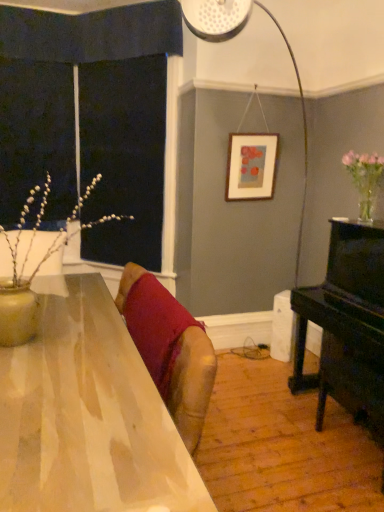
Image resolution: width=384 pixels, height=512 pixels. I want to click on matte wooden picture frame at upper center, so click(x=251, y=166).

Describe the element at coordinates (88, 415) in the screenshot. I see `shiny wooden table at center` at that location.

Describe the element at coordinates (187, 376) in the screenshot. I see `velvet red cushion at center` at that location.

Where is `black polished piano at right`? black polished piano at right is located at coordinates (346, 324).

Locate an element on the screen. The image size is (384, 512). matte wooden picture frame at upper center is located at coordinates (251, 166).

Is point (270, 192) positioned in front of point (167, 362)?

No, it is not.

From the image's perspective, would you say matte wooden picture frame at upper center is shown under velvet red cushion at center?

Incorrect, from the image's perspective, matte wooden picture frame at upper center is higher than velvet red cushion at center.

How distant is matte wooden picture frame at upper center from velvet red cushion at center?

matte wooden picture frame at upper center is 1.56 meters away from velvet red cushion at center.

How many degrees apart are the facing directions of matte wooden picture frame at upper center and velvet red cushion at center?

91.9 degrees.

Based on the photo, is translucent glass vase at right facing away from black polished piano at right?

translucent glass vase at right does not have its back to black polished piano at right.

Which object is positioned more to the right, translucent glass vase at right or black polished piano at right?

black polished piano at right is more to the right.

What's the angular difference between translucent glass vase at right and black polished piano at right's facing directions?

The angular difference between translucent glass vase at right and black polished piano at right is 0.651 degrees.

From a real-world perspective, is translucent glass vase at right above or below black polished piano at right?

Clearly, from a real-world perspective, translucent glass vase at right is above black polished piano at right.

From the image's perspective, which one is positioned lower, matte wooden picture frame at upper center or shiny wooden table at center?

shiny wooden table at center, from the image's perspective.

Considering the relative sizes of matte wooden picture frame at upper center and shiny wooden table at center in the image provided, is matte wooden picture frame at upper center shorter than shiny wooden table at center?

Correct, matte wooden picture frame at upper center is not as tall as shiny wooden table at center.

Is matte wooden picture frame at upper center located outside shiny wooden table at center?

Absolutely, matte wooden picture frame at upper center is external to shiny wooden table at center.

Which object is positioned more to the left, matte wooden picture frame at upper center or shiny wooden table at center?

Positioned to the left is shiny wooden table at center.

Considering the sizes of objects black polished piano at right and shiny wooden table at center in the image provided, who is bigger, black polished piano at right or shiny wooden table at center?

Bigger between the two is shiny wooden table at center.

Considering the positions of objects black polished piano at right and shiny wooden table at center in the image provided, who is behind, black polished piano at right or shiny wooden table at center?

Positioned behind is black polished piano at right.

Considering the relative sizes of black polished piano at right and shiny wooden table at center in the image provided, is black polished piano at right thinner than shiny wooden table at center?

Correct, the width of black polished piano at right is less than that of shiny wooden table at center.

Considering the sizes of objects velvet red cushion at center and shiny wooden table at center in the image provided, who is smaller, velvet red cushion at center or shiny wooden table at center?

velvet red cushion at center.

Which is closer, (203, 373) or (73, 292)?

The point (203, 373) is closer.

Is shiny wooden table at center surrounded by velvet red cushion at center?

Actually, shiny wooden table at center is outside velvet red cushion at center.

Looking at their sizes, would you say shiny wooden table at center is wider or thinner than matte wooden picture frame at upper center?

Clearly, shiny wooden table at center has more width compared to matte wooden picture frame at upper center.

Is shiny wooden table at center next to matte wooden picture frame at upper center and touching it?

shiny wooden table at center and matte wooden picture frame at upper center are not in contact.

Is shiny wooden table at center outside of matte wooden picture frame at upper center?

Absolutely, shiny wooden table at center is external to matte wooden picture frame at upper center.

Where is `table below the matte wooden picture frame at upper center (from the image's perspective)`? This screenshot has width=384, height=512. table below the matte wooden picture frame at upper center (from the image's perspective) is located at coordinates (88, 415).

This screenshot has width=384, height=512. I want to click on floral arrangement above the black polished piano at right (from a real-world perspective), so click(365, 179).

Visually, is black polished piano at right positioned to the left or to the right of translucent glass vase at right?

black polished piano at right is to the right of translucent glass vase at right.

Is black polished piano at right facing away from translucent glass vase at right?

No, black polished piano at right is not facing the opposite direction of translucent glass vase at right.

Where is `swivel chair on the left of matte wooden picture frame at upper center`? The width and height of the screenshot is (384, 512). swivel chair on the left of matte wooden picture frame at upper center is located at coordinates tap(187, 376).

Find the location of a particular element. floral arrangement located above the black polished piano at right (from a real-world perspective) is located at coordinates (365, 179).

Estimate the real-world distances between objects in this image. Which object is further from black polished piano at right, translucent glass vase at right or matte wooden picture frame at upper center?

matte wooden picture frame at upper center.

Looking at the image, which one is located further to black polished piano at right, velvet red cushion at center or translucent glass vase at right?

Based on the image, velvet red cushion at center appears to be further to black polished piano at right.

Based on their spatial positions, is matte wooden picture frame at upper center or black polished piano at right further from velvet red cushion at center?

Among the two, matte wooden picture frame at upper center is located further to velvet red cushion at center.

When comparing their distances from translucent glass vase at right, does velvet red cushion at center or black polished piano at right seem further?

Among the two, velvet red cushion at center is located further to translucent glass vase at right.

Which object lies further to the anchor point shiny wooden table at center, translucent glass vase at right or velvet red cushion at center?

translucent glass vase at right is positioned further to the anchor shiny wooden table at center.

Looking at this image, which object lies nearer to the anchor point matte wooden picture frame at upper center, velvet red cushion at center or translucent glass vase at right?

The object closer to matte wooden picture frame at upper center is translucent glass vase at right.

From the image, which object appears to be nearer to shiny wooden table at center, black polished piano at right or velvet red cushion at center?

velvet red cushion at center is closer to shiny wooden table at center.

Based on the photo, when comparing their distances from black polished piano at right, does velvet red cushion at center or shiny wooden table at center seem closer?

velvet red cushion at center is positioned closer to the anchor black polished piano at right.

Where is `floral arrangement situated between shiny wooden table at center and black polished piano at right from left to right`? This screenshot has height=512, width=384. floral arrangement situated between shiny wooden table at center and black polished piano at right from left to right is located at coordinates (365, 179).

Identify the location of swivel chair between shiny wooden table at center and matte wooden picture frame at upper center from front to back. (187, 376).

The height and width of the screenshot is (512, 384). I want to click on swivel chair between shiny wooden table at center and translucent glass vase at right, so click(187, 376).

Where is `floral arrangement between velvet red cushion at center and black polished piano at right`? The height and width of the screenshot is (512, 384). floral arrangement between velvet red cushion at center and black polished piano at right is located at coordinates (365, 179).